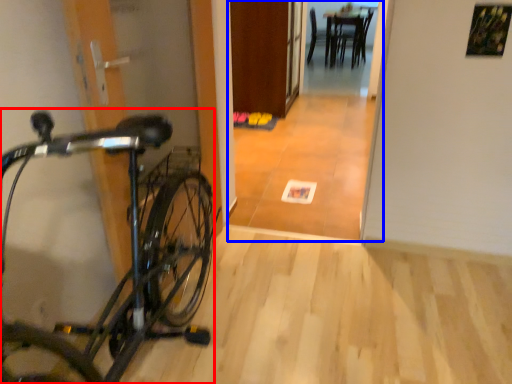
Question: Which object is further to the camera taking this photo, bicycle (highlighted by a red box) or corridor (highlighted by a blue box)?

Choices:
 (A) bicycle
 (B) corridor

Answer: (B)